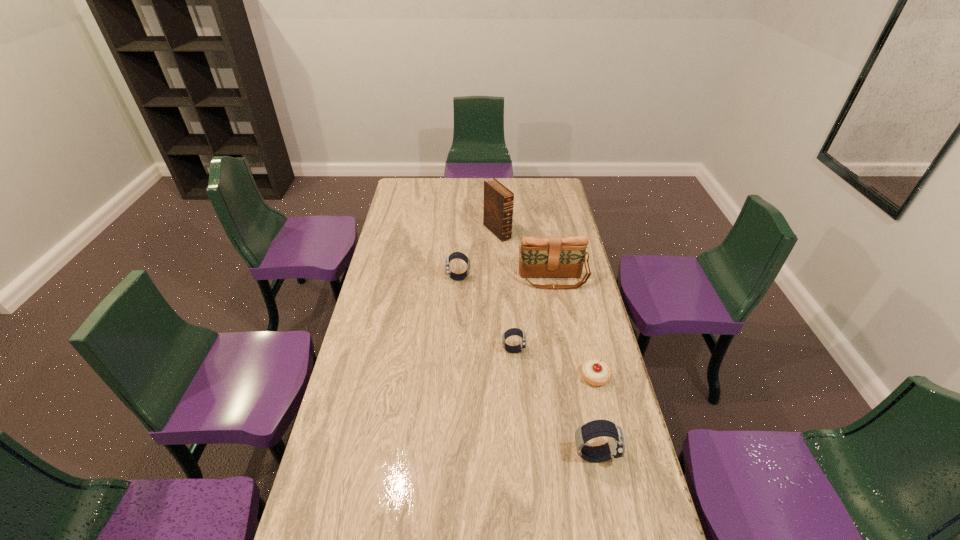
This screenshot has width=960, height=540. I want to click on the shortest object, so click(x=595, y=372).

This screenshot has width=960, height=540. Identify the location of vacant space situated on the face of the second tallest watch. (386, 278).

In order to click on vacant space located 0.210m on the face of the second tallest watch in this screenshot , I will do `click(396, 278)`.

This screenshot has height=540, width=960. What are the coordinates of `vacant space located 0.270m on the face of the second tallest watch` in the screenshot? It's located at (381, 278).

Identify the location of vacant space located 0.250m on the face of the second shortest object. The height and width of the screenshot is (540, 960). (596, 350).

I want to click on free space located on the left of the farthest object, so click(x=412, y=232).

The height and width of the screenshot is (540, 960). I want to click on free spot located 0.120m on the front-facing side of the second tallest object, so click(559, 311).

Locate an element on the screen. The width and height of the screenshot is (960, 540). vacant position located on the left of the shortest object is located at coordinates click(499, 377).

You are a GUI agent. You are given a task and a screenshot of the screen. Output one action in this format:
    pyautogui.click(x=<x>, y=<y>)
    Task: Click on the watch present at the right edge
    The image size is (960, 540).
    Given the screenshot: What is the action you would take?
    pyautogui.click(x=615, y=447)

Image resolution: width=960 pixels, height=540 pixels. I want to click on shoulder bag present at the right edge, so click(x=540, y=257).